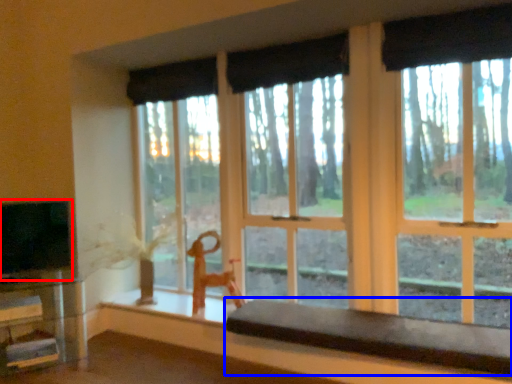
Question: Which of the following is the farthest to the observer, level (highlighted by a red box) or table (highlighted by a blue box)?

Choices:
 (A) level
 (B) table

Answer: (A)